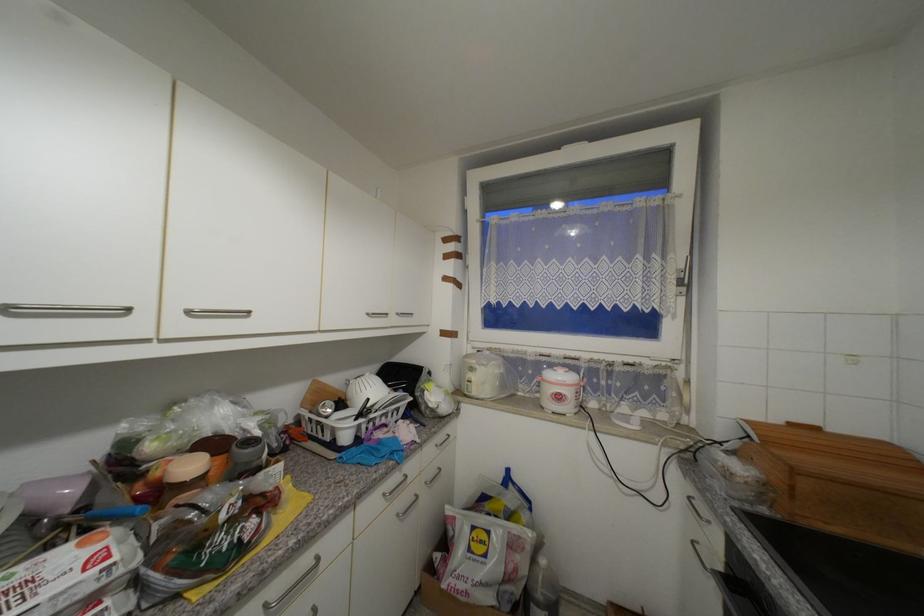
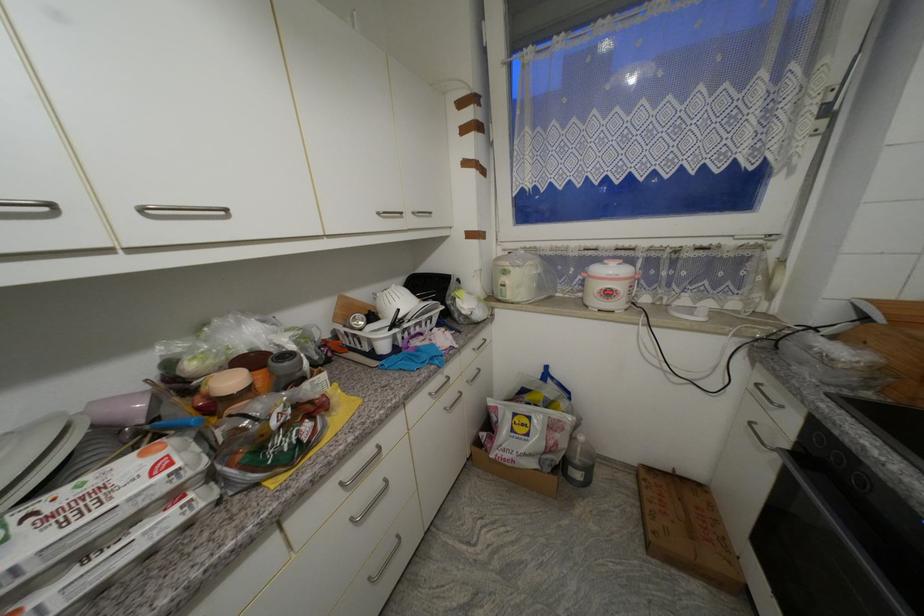
Where in the second image is the point corresponding to (x=734, y=565) from the first image?

(805, 446)